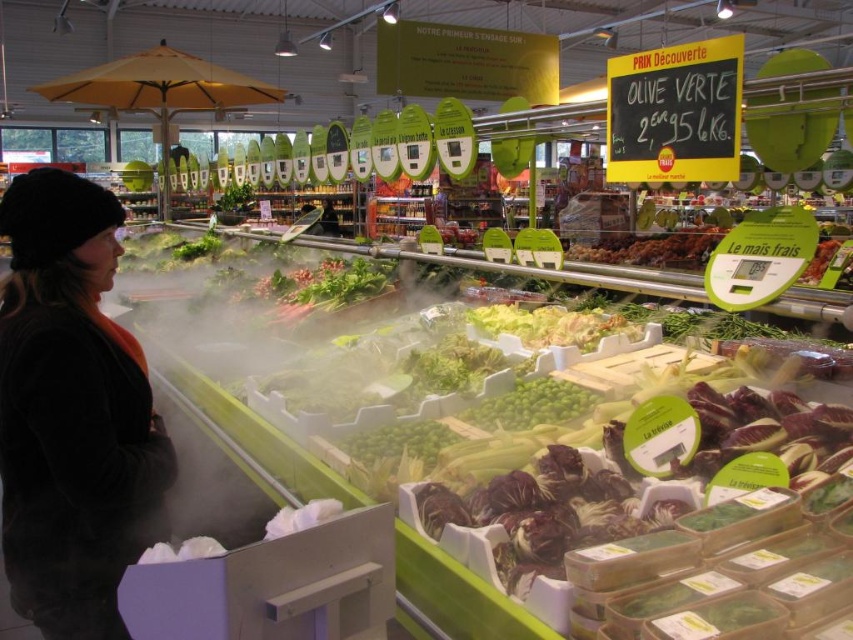
You are a customer in the market and want to locate the black fuzzy hat at upper left and the black chalkboard at upper right. Which object would you need to look at first if you enter the market from the front door, assuming the front door is at the bottom of the image?

The black fuzzy hat at upper left would be the first object you encounter because it is positioned at the upper left, which is typically closer to the entrance when entering from the bottom of the image.

You are a delivery person standing at the entrance of the refrigerated produce section. You need to pick up an item located at point (96, 588). Can you reach it without moving closer than 1.4 meters from your current position?

The distance of point (96, 588) from camera is 1.48 meters, so yes, you can reach it without moving closer than 1.4 meters since the point is 0.08 meters farther away than the required distance.

You are a customer in the store looking at the black fuzzy hat at upper left and the black chalkboard at upper right. Which object is higher up in the image?

The black fuzzy hat at upper left is taller than the black chalkboard at upper right, so the black fuzzy hat at upper left is higher up in the image.